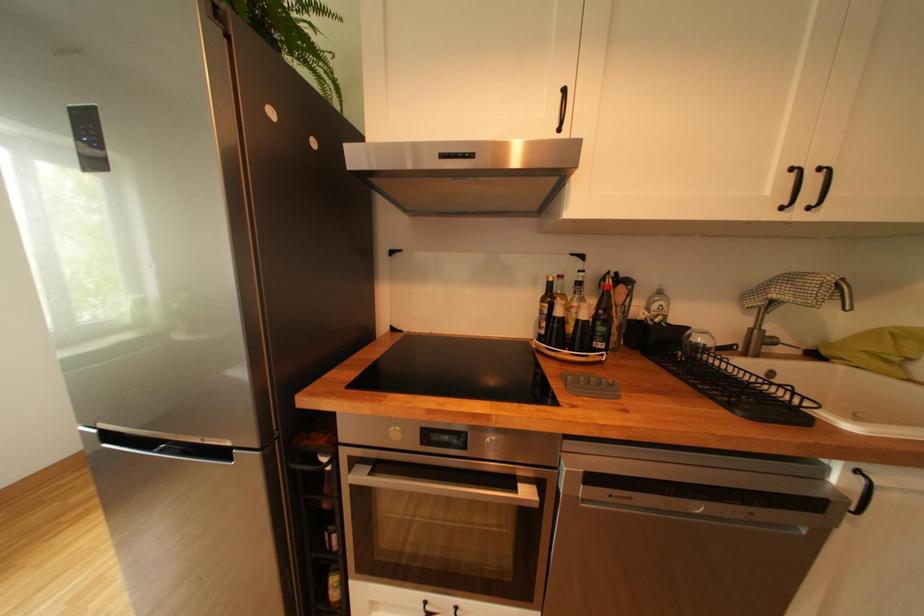
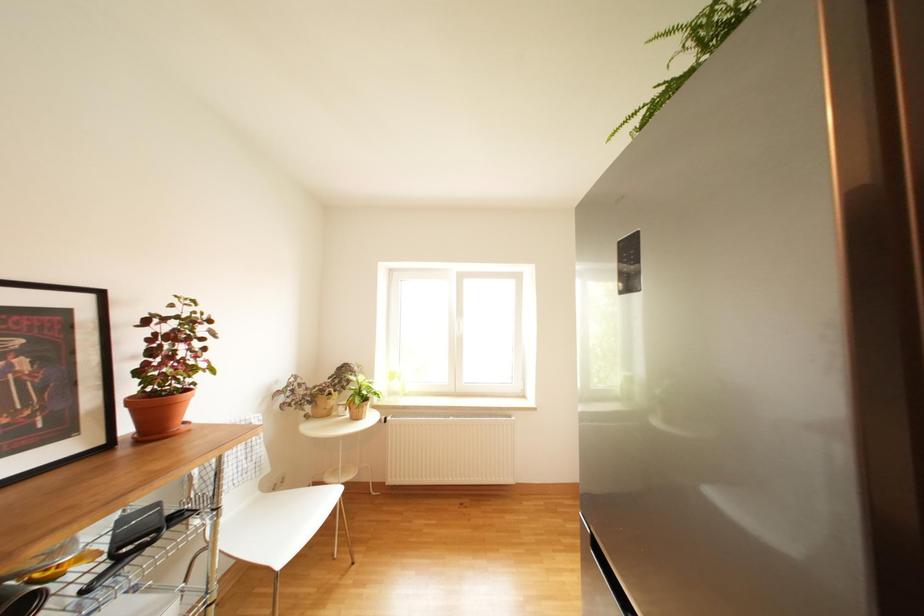
Question: The camera is either moving clockwise (left) or counter-clockwise (right) around the object. The first image is from the beginning of the video and the second image is from the end. Is the camera moving left or right when shooting the video?

Choices:
 (A) Left
 (B) Right

Answer: (B)